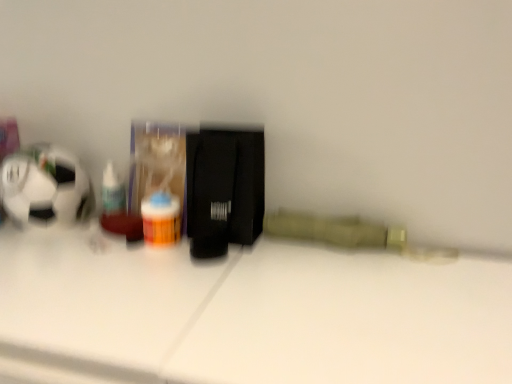
Find the location of a particular element. free space above white glossy table at center (from a real-world perspective) is located at coordinates (232, 276).